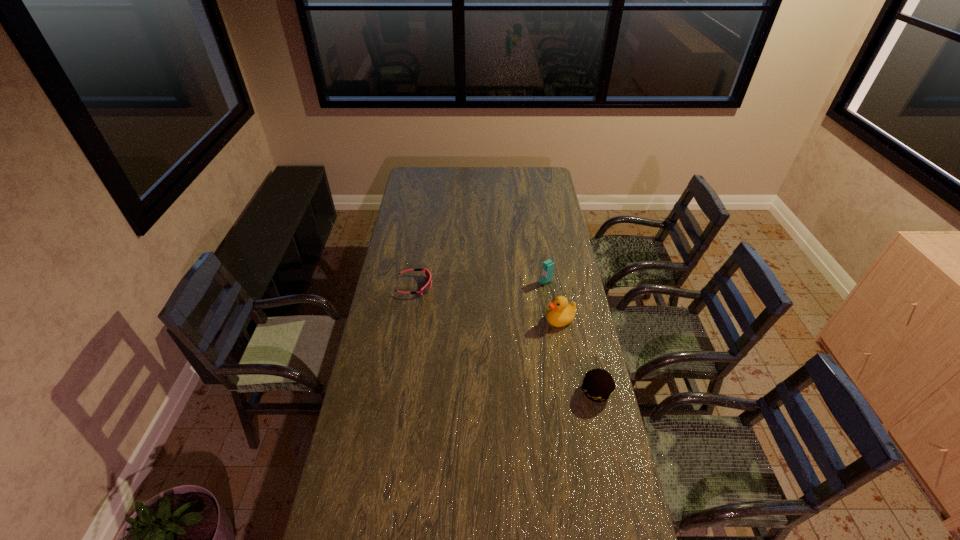
The width and height of the screenshot is (960, 540). In the image, there is a desktop. Identify the location of free space at the left edge. (395, 257).

The image size is (960, 540). I want to click on vacant position at the right edge of the desktop, so click(x=560, y=273).

This screenshot has height=540, width=960. I want to click on empty location between the cellular telephone and the patty, so click(571, 337).

I want to click on empty space that is in between the tallest object and the nearest object, so click(x=571, y=337).

Find the location of `free space between the shortest object and the duck`. free space between the shortest object and the duck is located at coordinates (488, 303).

At what (x,y) coordinates should I click in order to perform the action: click on vacant point located between the goggles and the third shortest object. Please return your answer as a coordinate pair (x, y). Looking at the image, I should click on (488, 303).

The height and width of the screenshot is (540, 960). Find the location of `free space between the cellular telephone and the leftmost object`. free space between the cellular telephone and the leftmost object is located at coordinates (480, 284).

Where is `vacant space in between the third shortest object and the goggles`? The height and width of the screenshot is (540, 960). vacant space in between the third shortest object and the goggles is located at coordinates (488, 303).

At what (x,y) coordinates should I click in order to perform the action: click on free space between the goggles and the nearest object. Please return your answer as a coordinate pair (x, y). The image size is (960, 540). Looking at the image, I should click on (505, 339).

This screenshot has height=540, width=960. Find the location of `free space that is in between the nearest object and the second tallest object`. free space that is in between the nearest object and the second tallest object is located at coordinates (578, 356).